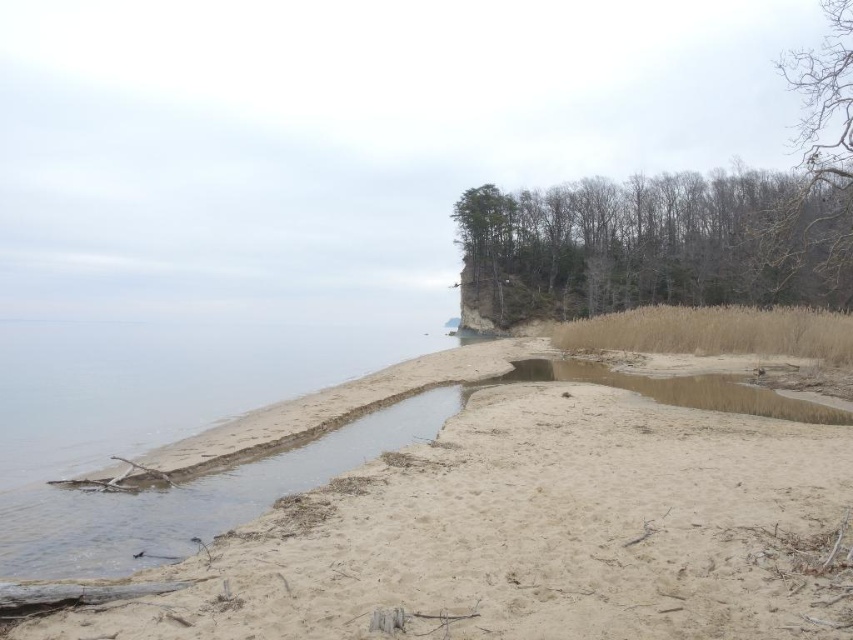
Who is positioned more to the left, bare branches at upper right or brown sandy puddle at lower right?

brown sandy puddle at lower right

Can you confirm if bare branches at upper right is thinner than brown sandy puddle at lower right?

Incorrect, bare branches at upper right's width is not less than brown sandy puddle at lower right's.

Image resolution: width=853 pixels, height=640 pixels. I want to click on bare branches at upper right, so click(x=816, y=172).

Between sandy beach at lower left and bare wood trees at upper right, which one has less height?

With less height is sandy beach at lower left.

Who is more forward, (836, 614) or (670, 250)?

Point (836, 614) is more forward.

You are a GUI agent. You are given a task and a screenshot of the screen. Output one action in this format:
    pyautogui.click(x=<x>, y=<y>)
    Task: Click on the sandy beach at lower left
    
    Given the screenshot: What is the action you would take?
    pyautogui.click(x=531, y=536)

Does sandy beach at lower left have a larger size compared to brown sandy puddle at lower right?

Indeed, sandy beach at lower left has a larger size compared to brown sandy puddle at lower right.

Who is taller, sandy beach at lower left or brown sandy puddle at lower right?

sandy beach at lower left is taller.

Identify the location of sandy beach at lower left. (531, 536).